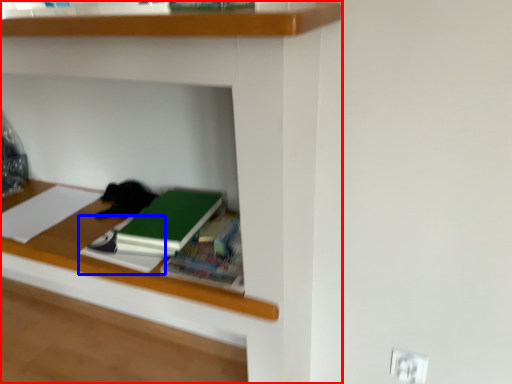
Question: Among these objects, which one is nearest to the camera, shelf (highlighted by a red box) or notebook (highlighted by a blue box)?

Choices:
 (A) shelf
 (B) notebook

Answer: (A)